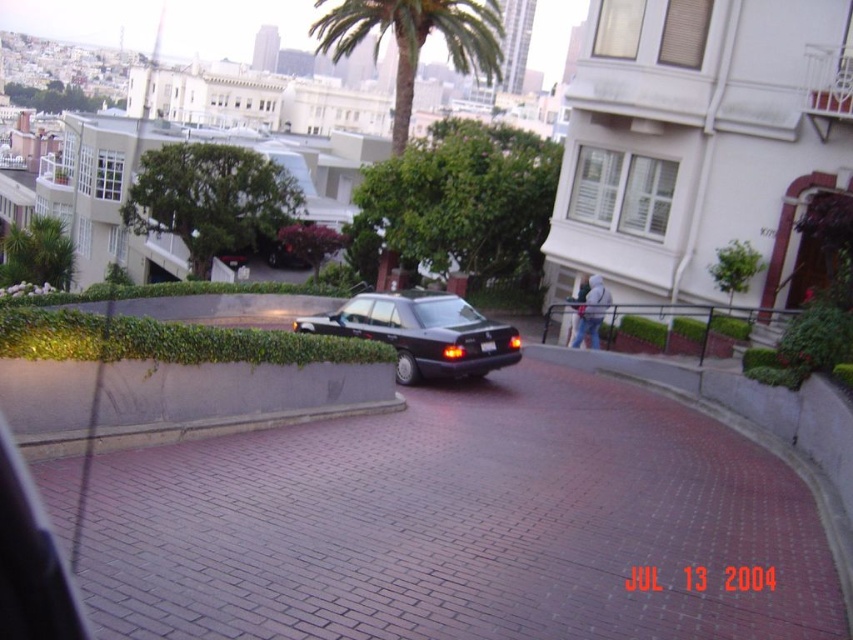
Who is more forward, (468, 323) or (396, 29)?

Point (468, 323)

Identify the location of satin black sedan at center. (422, 332).

Who is more forward, (520, 346) or (485, 352)?

Point (485, 352) is more forward.

Who is higher up, satin black sedan at center or black plastic license plate at center?

satin black sedan at center is higher up.

The width and height of the screenshot is (853, 640). Identify the location of satin black sedan at center. (422, 332).

Between point (426, 16) and point (486, 346), which one is positioned behind?

The point (426, 16) is behind.

Does green leafy palm tree at upper center have a smaller size compared to black plastic license plate at center?

Actually, green leafy palm tree at upper center might be larger than black plastic license plate at center.

The image size is (853, 640). What are the coordinates of `green leafy palm tree at upper center` in the screenshot? It's located at 415,40.